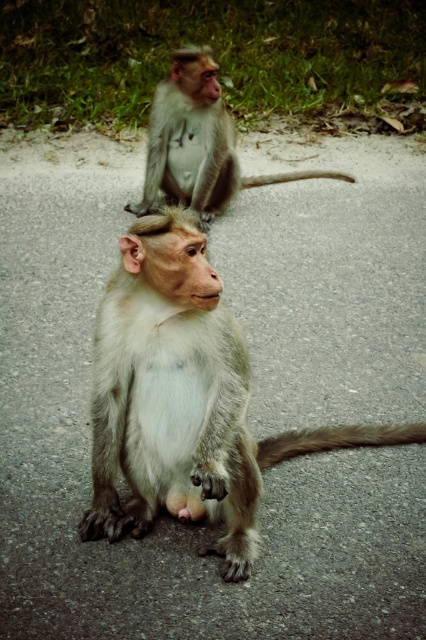
Question: Can you confirm if gray furry monkey at center is wider than gray fur monkey at upper center?

Choices:
 (A) yes
 (B) no

Answer: (B)

Question: Which object appears farthest from the camera in this image?

Choices:
 (A) gray fur monkey at upper center
 (B) gray furry monkey at center

Answer: (A)

Question: From the image, what is the correct spatial relationship of gray furry monkey at center in relation to gray fur monkey at upper center?

Choices:
 (A) left
 (B) right

Answer: (A)

Question: Does gray furry monkey at center appear on the right side of gray fur monkey at upper center?

Choices:
 (A) no
 (B) yes

Answer: (A)